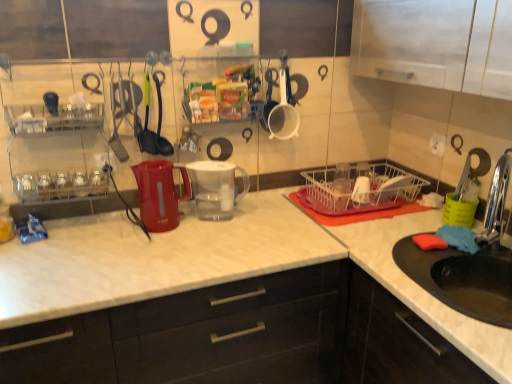
Question: Is green rubber spoon at center, the third tableware from the right, spatially inside transparent plastic cups at center, which is the 1th tableware in right-to-left order, or outside of it?

Choices:
 (A) outside
 (B) inside

Answer: (A)

Question: From the image's perspective, relative to transparent plastic cups at center, which is the 1th tableware in right-to-left order, is green rubber spoon at center, the third tableware from the right, above or below?

Choices:
 (A) above
 (B) below

Answer: (A)

Question: Considering the real-world distances, which object is farthest from the white marble countertop at center?

Choices:
 (A) green rubber spoon at center, which appears as the 2th tableware when viewed from the left
 (B) transparent plastic cups at center, which is the 1th tableware in right-to-left order
 (C) white wire basket at center
 (D) black matte sink at lower right, placed as the second cabinetry when sorted from left to right
 (E) chrome metallic faucet at sink right

Answer: (E)

Question: Which is farther from the transparent plastic water filter pitcher at center, acting as the 1th appliance starting from the right?

Choices:
 (A) green plastic spatula at center, which is the fourth tableware in right-to-left order
 (B) white matte measuring cup at upper center, acting as the 2th tableware starting from the right
 (C) green rubber spoon at center, the third tableware from the right
 (D) transparent plastic cups at center, which is the 1th tableware in right-to-left order
 (E) matte white countertop at center, placed as the 1th cabinetry when sorted from left to right

Answer: (E)